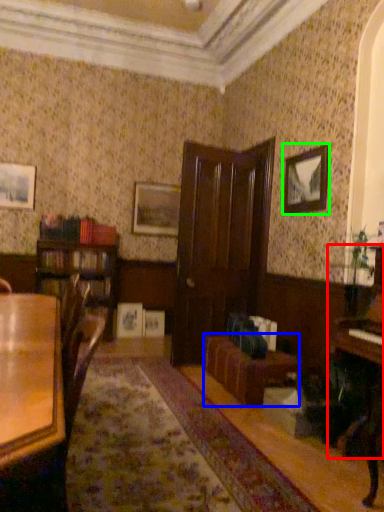
Question: Estimate the real-world distances between objects in this image. Which object is farther from piano (highlighted by a red box), couch (highlighted by a blue box) or picture frame (highlighted by a green box)?

Choices:
 (A) couch
 (B) picture frame

Answer: (B)